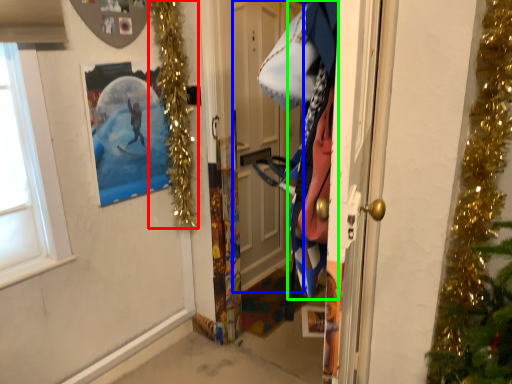
Question: Based on their relative distances, which object is farther from christmas light (highlighted by a red box)? Choose from door (highlighted by a blue box) and clothing (highlighted by a green box).

Choices:
 (A) door
 (B) clothing

Answer: (B)